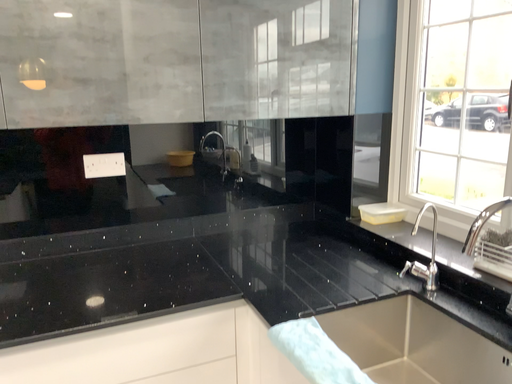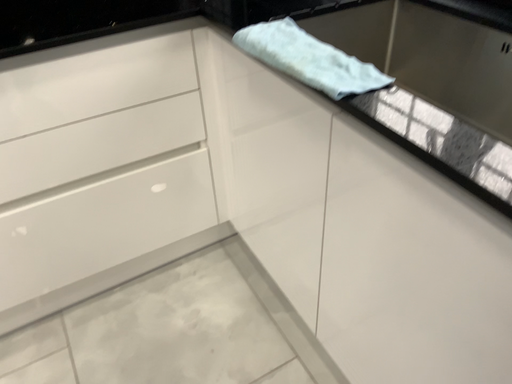
Question: How did the camera likely rotate when shooting the video?

Choices:
 (A) rotated downward
 (B) rotated upward

Answer: (A)